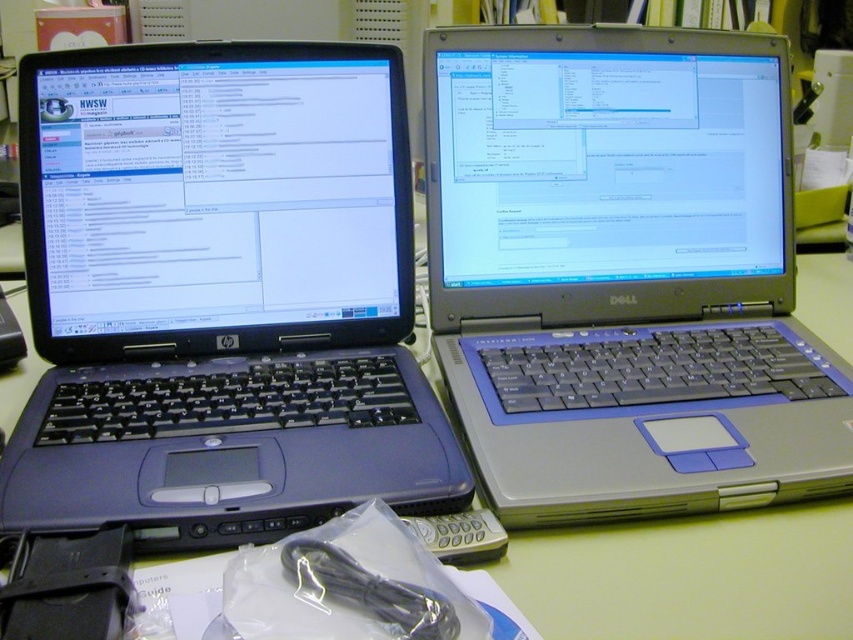
Question: Which point is farther to the camera?

Choices:
 (A) silver metallic laptop at upper right
 (B) matte plastic computer desk at center
 (C) matte black laptop at left

Answer: (A)

Question: Does matte black laptop at left have a smaller size compared to matte plastic computer desk at center?

Choices:
 (A) yes
 (B) no

Answer: (A)

Question: Observing the image, what is the correct spatial positioning of silver metallic laptop at upper right in reference to matte plastic computer desk at center?

Choices:
 (A) above
 (B) below

Answer: (A)

Question: Which is nearer to the matte black laptop at left?

Choices:
 (A) silver metallic laptop at upper right
 (B) matte plastic computer desk at center

Answer: (A)

Question: Based on their relative distances, which object is farther from the matte black laptop at left?

Choices:
 (A) silver metallic laptop at upper right
 (B) matte plastic computer desk at center

Answer: (B)

Question: In this image, where is matte black laptop at left located relative to silver metallic laptop at upper right?

Choices:
 (A) below
 (B) above

Answer: (A)